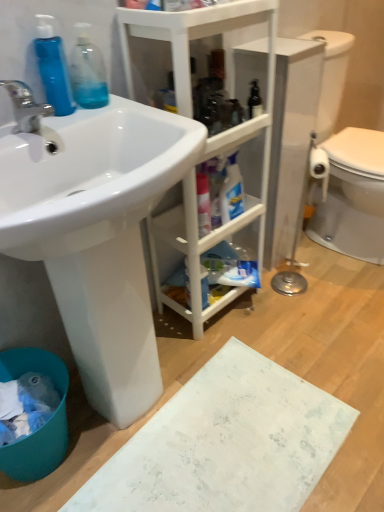
Where is `vacant space to the right of transparent plastic bottle at upper left, the 2th cleaning product when ordered from left to right`? vacant space to the right of transparent plastic bottle at upper left, the 2th cleaning product when ordered from left to right is located at coordinates (134, 108).